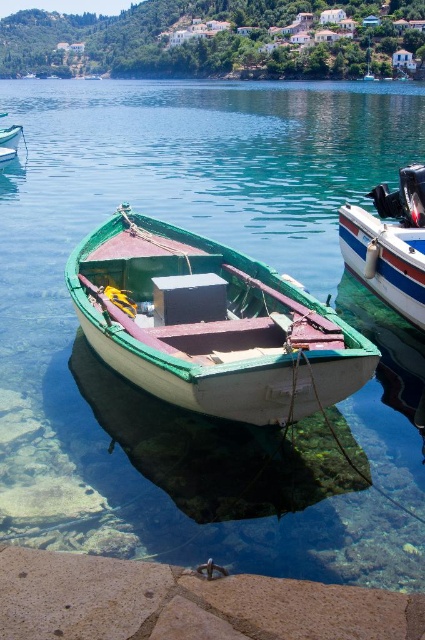
Question: Which object appears closest to the camera in this image?

Choices:
 (A) white glossy boat at right
 (B) green wooden boat at center

Answer: (B)

Question: Which of these objects is positioned closest to the white glossy boat at right?

Choices:
 (A) brown stone at lower left
 (B) green wooden boat at center

Answer: (B)

Question: Does green wooden boat at center lie in front of brown stone at lower left?

Choices:
 (A) yes
 (B) no

Answer: (B)

Question: Which object appears closest to the camera in this image?

Choices:
 (A) brown stone at lower left
 (B) green wooden boat at center

Answer: (A)

Question: Does green wooden boat at center have a smaller size compared to white glossy boat at right?

Choices:
 (A) no
 (B) yes

Answer: (B)

Question: Does green wooden boat at center appear on the left side of white glossy boat at right?

Choices:
 (A) yes
 (B) no

Answer: (A)